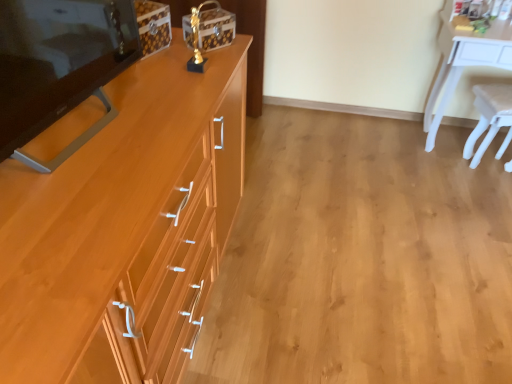
What are the coordinates of `empty space that is ontop of light brown wood cabinet at left (from a real-world perspective)` in the screenshot? It's located at (105, 136).